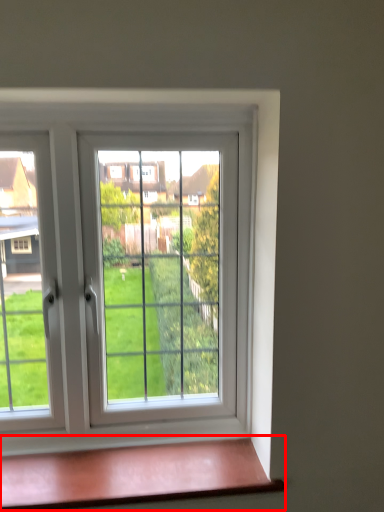
Question: Considering the relative positions of window sill (annotated by the red box) and window in the image provided, where is window sill (annotated by the red box) located with respect to the staircase?

Choices:
 (A) left
 (B) right

Answer: (B)